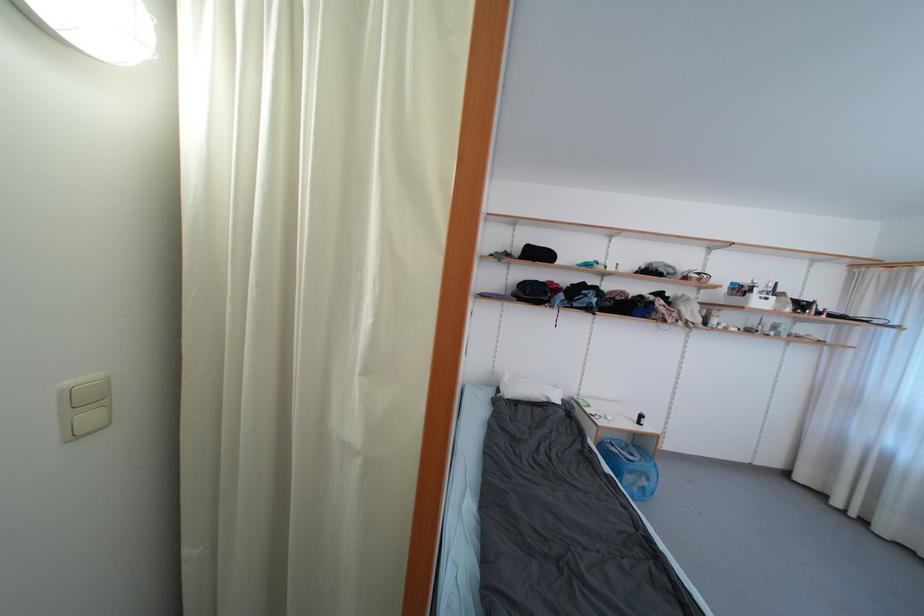
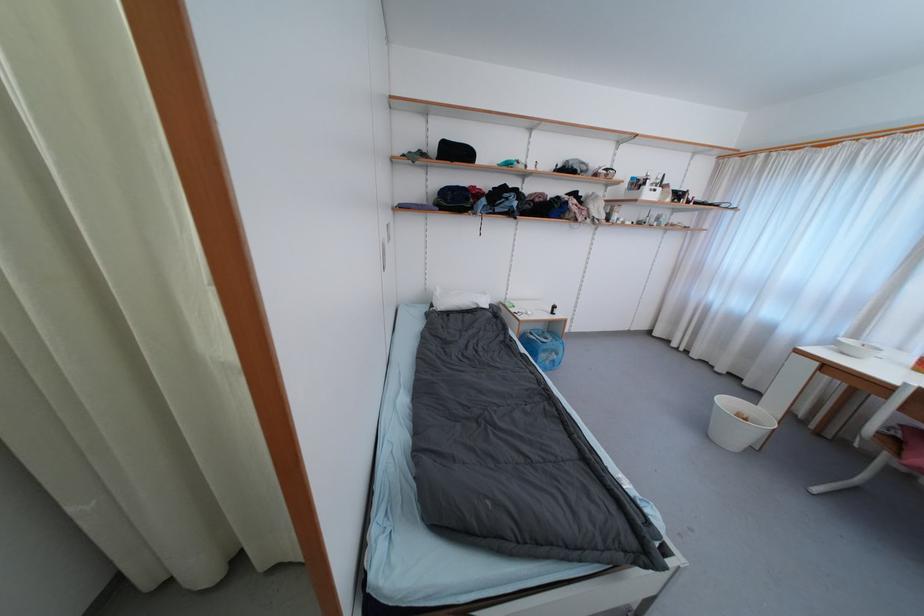
Find the pixel in the second image that matches the point at 555,285 in the first image.

(478, 190)